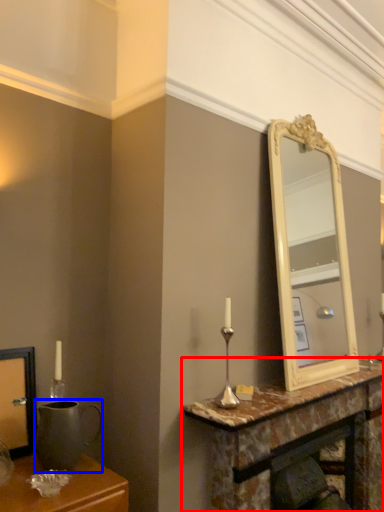
Question: Which point is further to the camera, table (highlighted by a red box) or gray (highlighted by a blue box)?

Choices:
 (A) table
 (B) gray

Answer: (A)